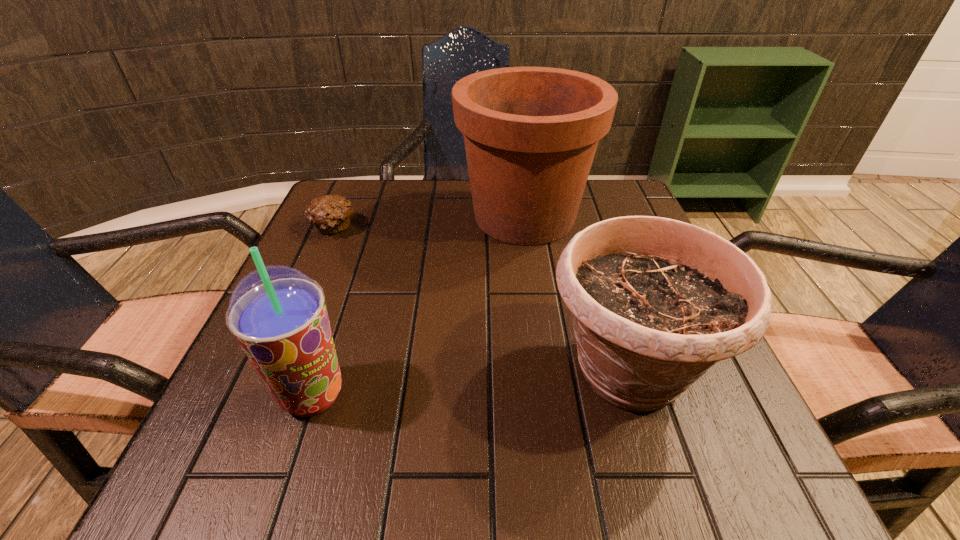
The height and width of the screenshot is (540, 960). What are the coordinates of `the taller flowerpot` in the screenshot? It's located at (531, 133).

At what (x,y) coordinates should I click in order to perform the action: click on smoothie. Please return your answer as a coordinate pair (x, y). Looking at the image, I should click on (278, 314).

At what (x,y) coordinates should I click in order to perform the action: click on the shorter flowerpot. Please return your answer as a coordinate pair (x, y). The image size is (960, 540). Looking at the image, I should click on (655, 302).

Find the location of a particular element. This screenshot has width=960, height=540. the nearer flowerpot is located at coordinates (655, 302).

The image size is (960, 540). I want to click on muffin, so click(330, 214).

The height and width of the screenshot is (540, 960). Identify the location of free space located 0.290m on the front of the taller flowerpot. (546, 376).

The image size is (960, 540). Identify the location of vacant space located on the back of the smoothie. (337, 322).

Locate an element on the screen. vacant point located 0.240m on the back of the nearer flowerpot is located at coordinates (586, 233).

Find the location of a particular element. free region located on the right of the muffin is located at coordinates (434, 228).

Identify the location of flowerpot that is at the far edge. (531, 133).